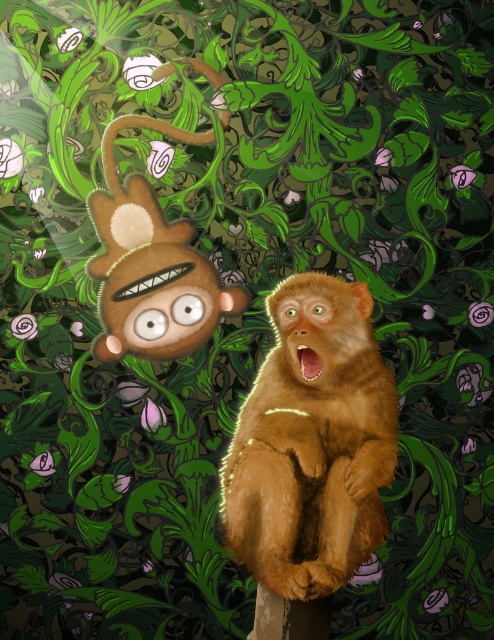
Question: Which object is farther from the camera taking this photo?

Choices:
 (A) fuzzy brown monkey at center
 (B) fuzzy brown plush at upper left

Answer: (B)

Question: Which point is closer to the camera?

Choices:
 (A) fuzzy brown plush at upper left
 (B) fuzzy brown monkey at center

Answer: (B)

Question: Is fuzzy brown monkey at center thinner than fuzzy brown plush at upper left?

Choices:
 (A) no
 (B) yes

Answer: (B)

Question: Can you confirm if fuzzy brown monkey at center is wider than fuzzy brown plush at upper left?

Choices:
 (A) yes
 (B) no

Answer: (B)

Question: In this image, where is fuzzy brown monkey at center located relative to fuzzy brown plush at upper left?

Choices:
 (A) right
 (B) left

Answer: (A)

Question: Which of the following is the closest to the observer?

Choices:
 (A) (160, 337)
 (B) (350, 449)

Answer: (B)